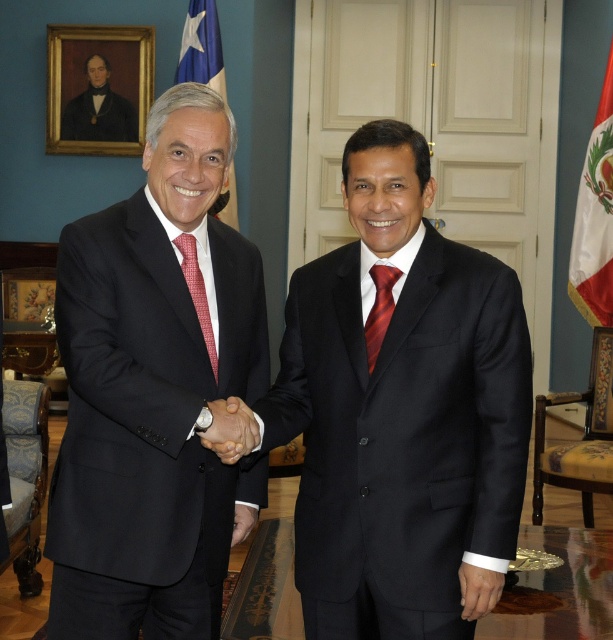
Question: Does blue fabric flag at upper center come in front of red textured tie at left?

Choices:
 (A) yes
 (B) no

Answer: (B)

Question: Where is white fabric flag at right located in relation to blue fabric flag at upper center in the image?

Choices:
 (A) above
 (B) below

Answer: (B)

Question: Which of the following is the farthest from the observer?

Choices:
 (A) (213, 369)
 (B) (80, 99)

Answer: (B)

Question: Can you confirm if dark blue suit at upper left is wider than matte black hand at center?

Choices:
 (A) yes
 (B) no

Answer: (A)

Question: Which of the following is the farthest from the observer?

Choices:
 (A) (313, 490)
 (B) (381, 317)
 (C) (242, 436)

Answer: (A)

Question: Among these points, which one is nearest to the camera?

Choices:
 (A) (370, 365)
 (B) (603, 163)
 (C) (452, 394)

Answer: (C)